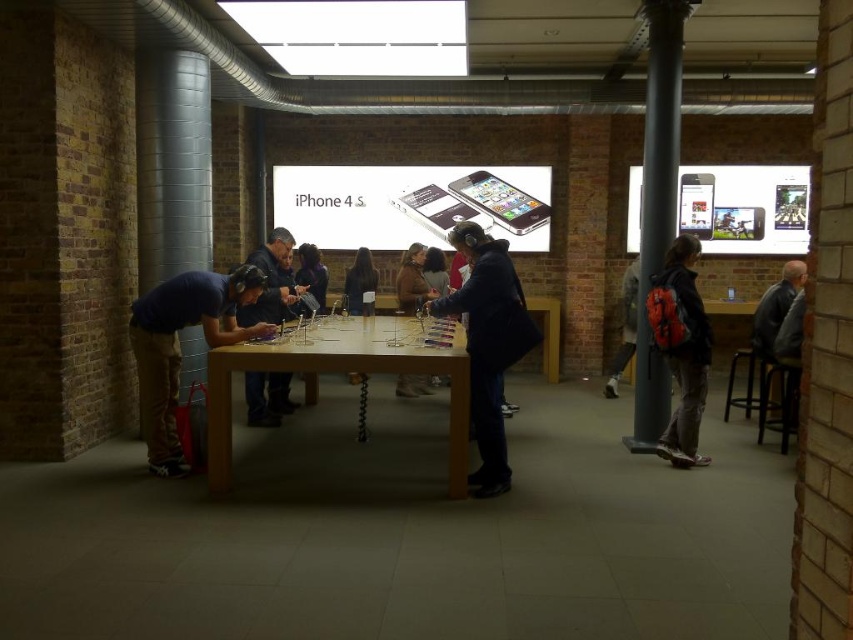
You are a customer in the Apple Store and want to place your leather jacket at right and dark gray backpack at right on the wooden table. The table has a width of 1.2 meters. Can both items fit side by side on the table without overlapping?

The leather jacket at right might be wider than dark gray backpack at right. Since the table is 1.2 meters wide, it depends on their combined widths. If the jacket is wider, their total width could exceed the table length, making it uncertain if they fit without overlapping.